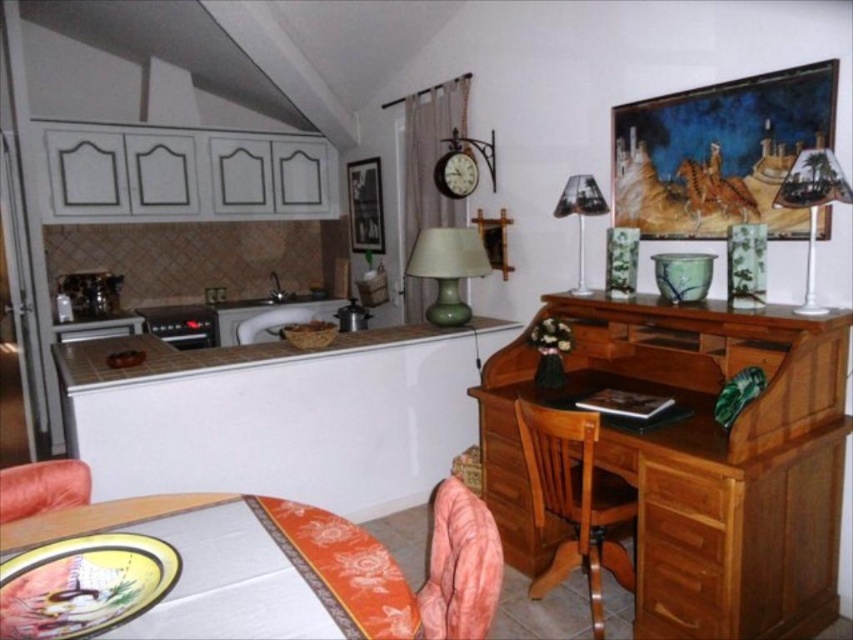
Who is more distant from viewer, (700, 548) or (469, 262)?

Point (469, 262)

This screenshot has height=640, width=853. Find the location of `wooden desk at right`. wooden desk at right is located at coordinates (695, 458).

Can you confirm if wooden desk at right is wider than wooden chair at lower center?

Yes.

The width and height of the screenshot is (853, 640). What do you see at coordinates (695, 458) in the screenshot?
I see `wooden desk at right` at bounding box center [695, 458].

Is point (772, 410) less distant than point (515, 400)?

Yes, it is.

Where is `wooden desk at right`? The height and width of the screenshot is (640, 853). wooden desk at right is located at coordinates (695, 458).

Describe the element at coordinates (447, 268) in the screenshot. I see `green matte lamp at center` at that location.

Is point (479, 232) closer to viewer compared to point (57, 502)?

No, (479, 232) is further to viewer.

Locate an element on the screen. The width and height of the screenshot is (853, 640). green matte lamp at center is located at coordinates (447, 268).

Find the location of `green matte lamp at center`. green matte lamp at center is located at coordinates (447, 268).